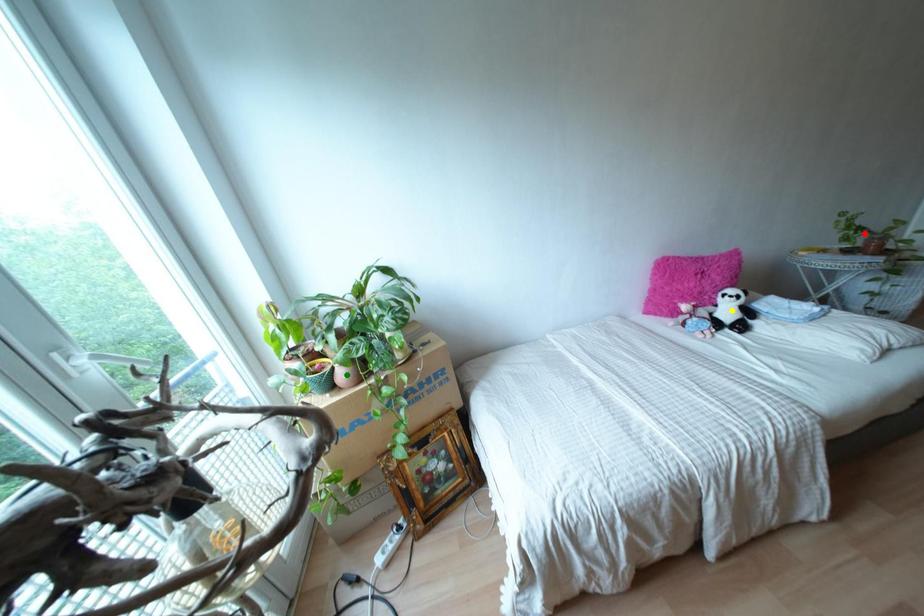
Order these from farthest to nearest:
red point
green point
yellow point

red point
yellow point
green point